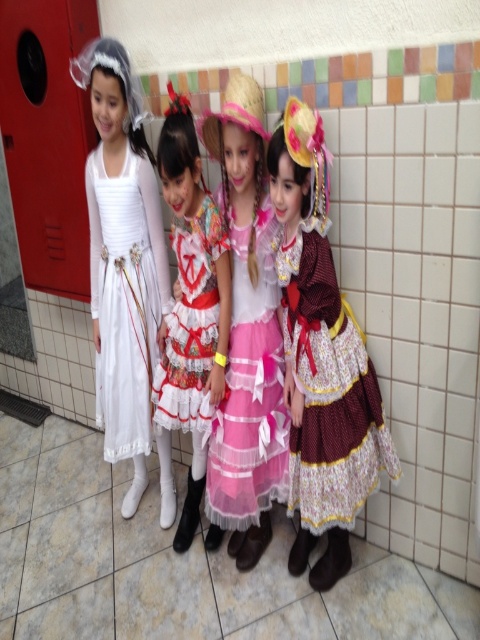
You are standing in front of the tiled wall and want to place a small decoration exactly at the center of the maroon satin dress at right. According to the coordinates provided, where should you place the decoration?

The maroon satin dress at right is located at point (x=328, y=390), so you should place the decoration at those coordinates to center it on the dress.

You are a photographer trying to capture a group photo of the girls. You want to ensure that the white satin dress at left and the pink tulle dress at center are exactly 20 inches apart. Based on the current spacing between them, is this requirement met?

The white satin dress at left and the pink tulle dress at center are currently 20.42 inches apart, which is slightly more than the desired 20 inches. To meet the requirement, the photographer should move the girls closer together by approximately 0.42 inches.

You are a photographer setting up for a group photo. You need to arrange the girls so that the white satin dress at left and the pink tulle dress at center are visible to the camera. Given their sizes, which dress should be placed closer to the front to ensure both are fully visible?

The white satin dress at left is larger than the pink tulle dress at center. To ensure both are fully visible, the pink tulle dress at center should be placed closer to the front so it doesn not get obscured by the larger white satin dress at left.